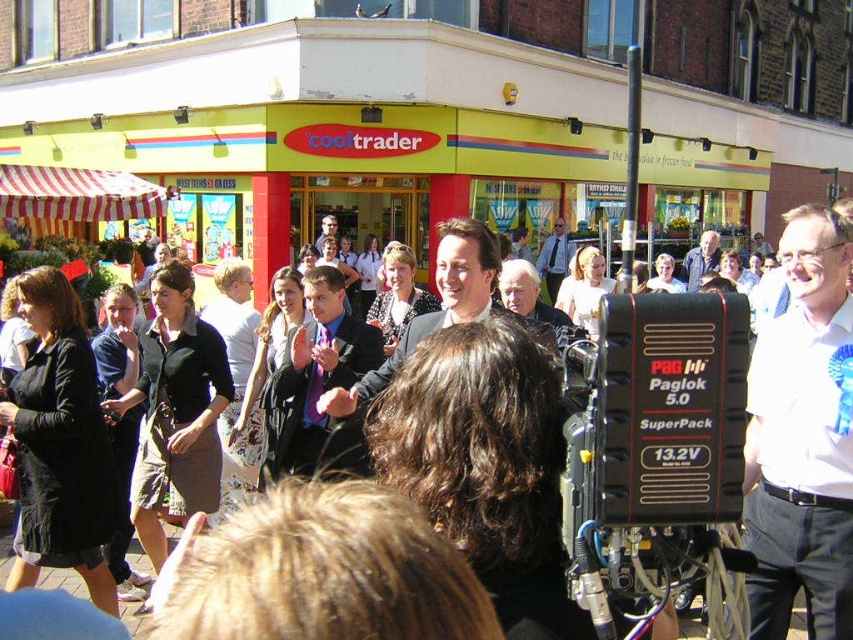
From the picture: You are standing at the edge of the scene and want to reach the blue suit at center without getting too close to the black fabric crowd at center. Can you walk around them? Please explain your reasoning based on the distance provided.

The black fabric crowd at center is 3.32 feet away from the blue suit at center. Since the distance between them is relatively small, you might not have enough space to walk around without getting close. Consider checking other paths or waiting for the crowd to disperse for a safer route.

You are a photographer at the event, and you need to capture a clear photo of both the blue suit at center and the light blue shirt at center. Since you want to ensure both are fully visible, which one should you focus on first to avoid cropping the top of the frame?

The blue suit at center is taller than the light blue shirt at center, so you should focus on the blue suit at center first to ensure its full height fits within the frame.

You are at a public event and see a black fabric crowd at center and a blue suit at center. Which one is positioned to the right of the other?

The black fabric crowd at center is positioned to the right of the blue suit at center.